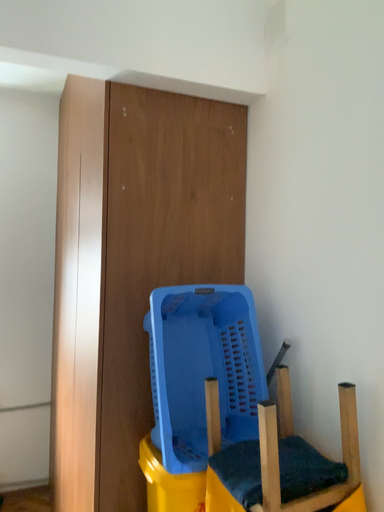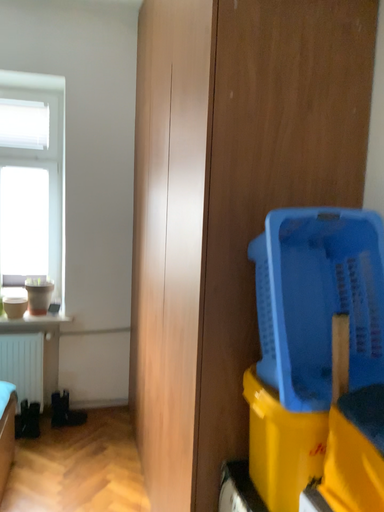
Question: Which way did the camera rotate in the video?

Choices:
 (A) rotated right
 (B) rotated left

Answer: (B)